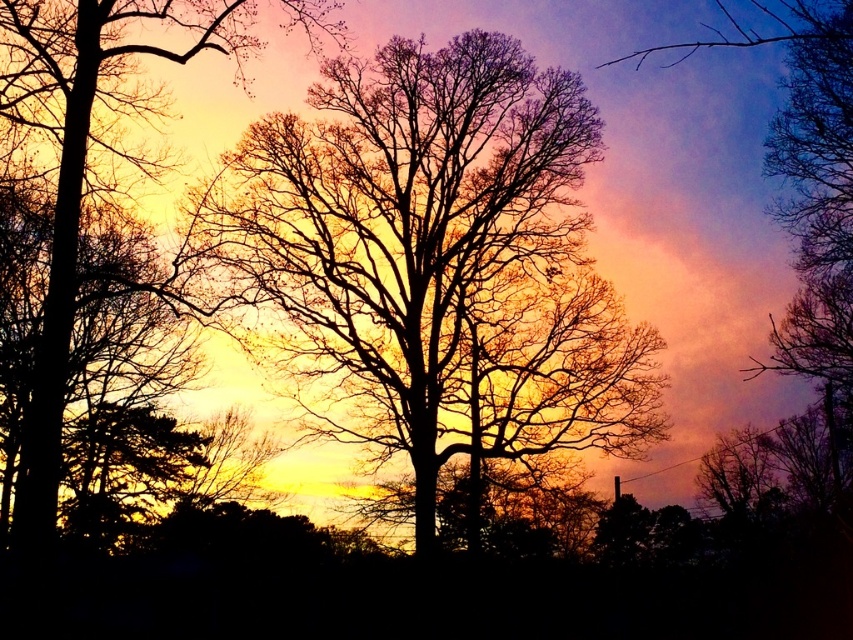
You are an artist sketching the sunset scene. You notice two silhouette trees in your view. Which silhouette tree is positioned higher in the image, the silhouette tree at center or the silhouette tree at left?

The silhouette tree at center is positioned higher in the image than the silhouette tree at left.

You are an artist planning to paint the sunset scene. You have two trees in your viewfinder, the silhouette tree at center and the silhouette tree at left. Which tree should you paint wider to maintain the scene proportions?

You should paint the silhouette tree at center wider because its width is larger than the silhouette tree at left.